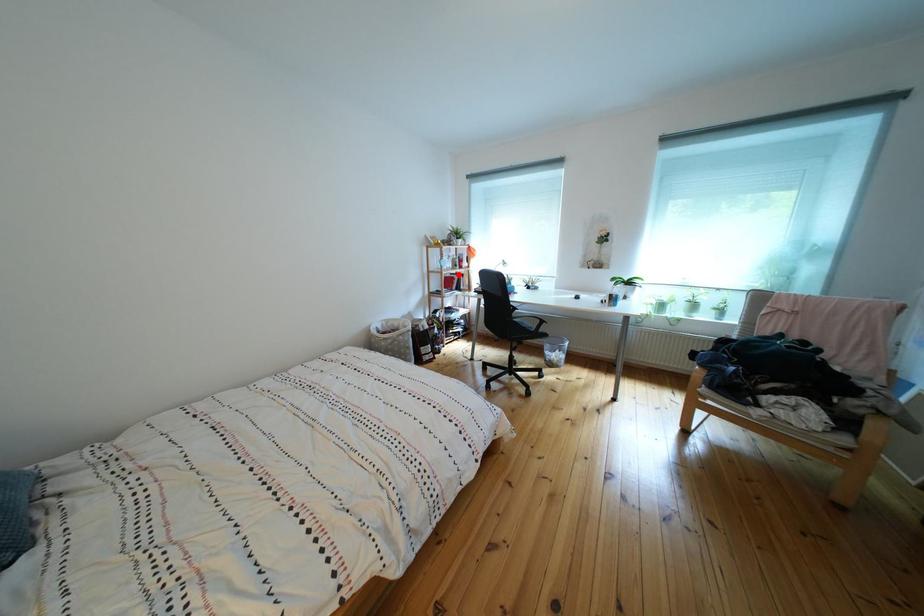
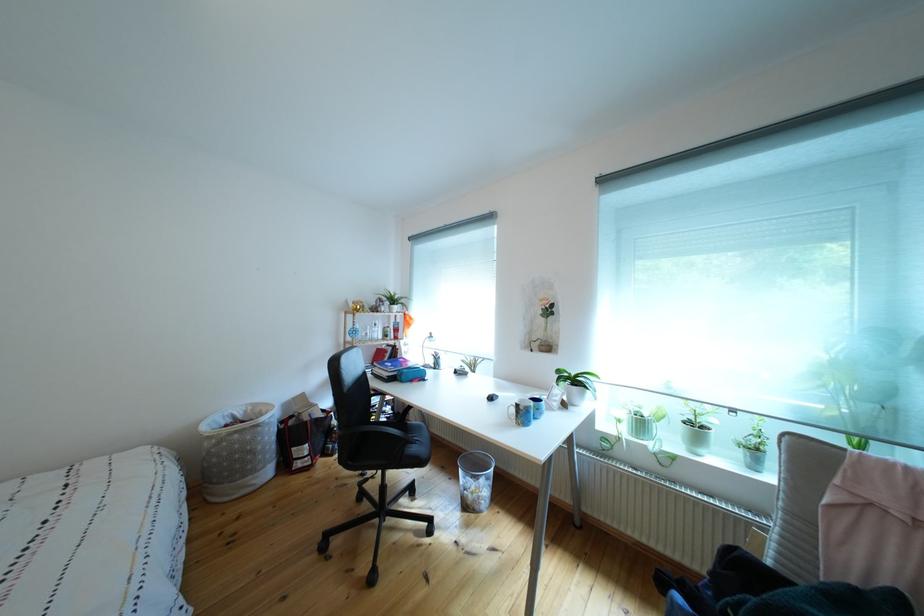
In the second image, find the point that corresponds to the highlighted location in the first image.

(383, 345)